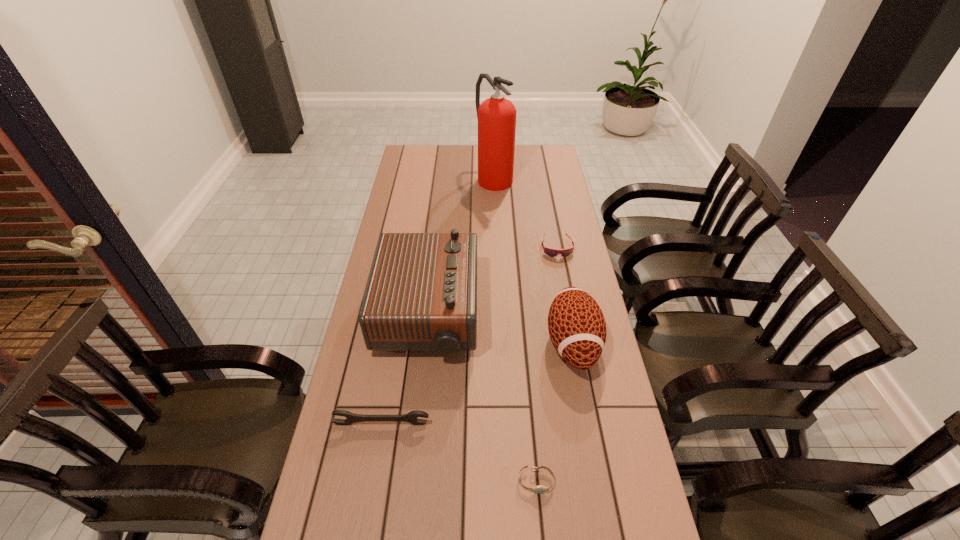
In order to click on vacant point located 0.210m on the handle side of the fire extinguisher in this screenshot , I will do `click(495, 224)`.

What are the coordinates of `vacant point located 0.330m on the tuning display of the radio receiver` in the screenshot? It's located at (581, 315).

Locate an element on the screen. free region located on the left of the fourth shortest object is located at coordinates (459, 343).

Where is `free space located on the open ends of the wrench`? Image resolution: width=960 pixels, height=540 pixels. free space located on the open ends of the wrench is located at coordinates click(370, 495).

Find the location of a particular element. The height and width of the screenshot is (540, 960). free space located 0.250m on the front-facing side of the fifth tallest object is located at coordinates (569, 310).

You are a GUI agent. You are given a task and a screenshot of the screen. Output one action in this format:
    pyautogui.click(x=<x>, y=<y>)
    Task: Click on the object that is at the far edge
    The width and height of the screenshot is (960, 540).
    Given the screenshot: What is the action you would take?
    pyautogui.click(x=496, y=116)

Locate an element on the screen. The height and width of the screenshot is (540, 960). radio receiver that is at the left edge is located at coordinates (421, 294).

Find the location of a particular element. wrench located at the left edge is located at coordinates (412, 417).

Find the location of a particular element. The width and height of the screenshot is (960, 540). football that is at the right edge is located at coordinates (576, 324).

Find the location of a particular element. Image resolution: width=960 pixels, height=540 pixels. goggles located in the right edge section of the desktop is located at coordinates (551, 252).